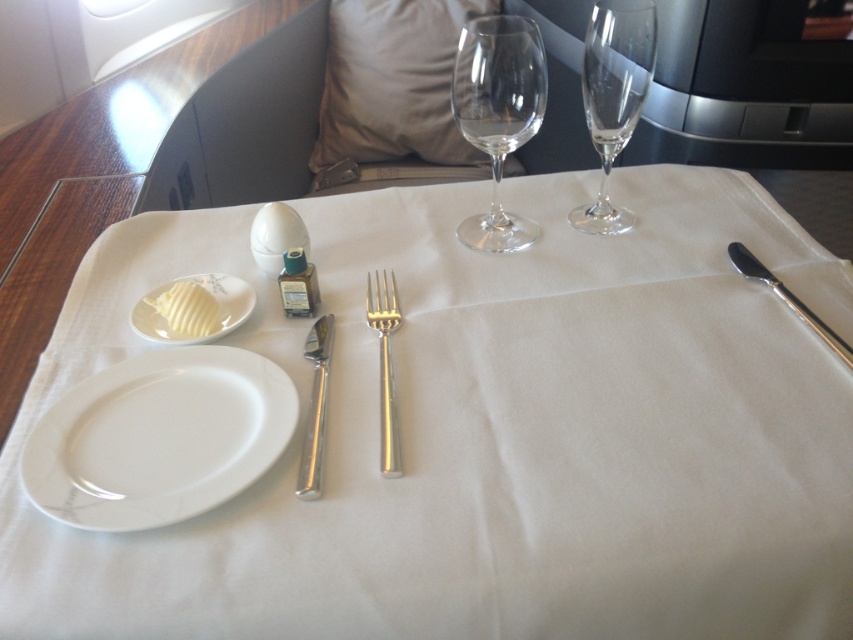
Describe the element at coordinates (315, 408) in the screenshot. I see `polished silver knife at center-left` at that location.

Can you confirm if polished silver knife at center-left is positioned to the right of polished silver knife at right?

Incorrect, polished silver knife at center-left is not on the right side of polished silver knife at right.

Who is more distant from viewer, (316, 428) or (846, 356)?

The point (846, 356) is behind.

What are the coordinates of `polished silver knife at center-left` in the screenshot? It's located at (315, 408).

Is polished silver fork at center smaller than polished silver knife at right?

Incorrect, polished silver fork at center is not smaller in size than polished silver knife at right.

Who is higher up, polished silver fork at center or polished silver knife at right?

polished silver knife at right is higher up.

Who is more distant from viewer, [395,428] or [830,339]?

The point [830,339] is behind.

Image resolution: width=853 pixels, height=640 pixels. Find the location of `polished silver fork at center`. polished silver fork at center is located at coordinates (386, 365).

Which is below, transparent glass wine glass at center or polished silver knife at right?

Positioned lower is polished silver knife at right.

Can you confirm if transparent glass wine glass at center is positioned above polished silver knife at right?

Yes.

Is point (490, 211) closer to viewer compared to point (845, 356)?

No, (490, 211) is further to viewer.

Locate an element on the screen. transparent glass wine glass at center is located at coordinates (498, 113).